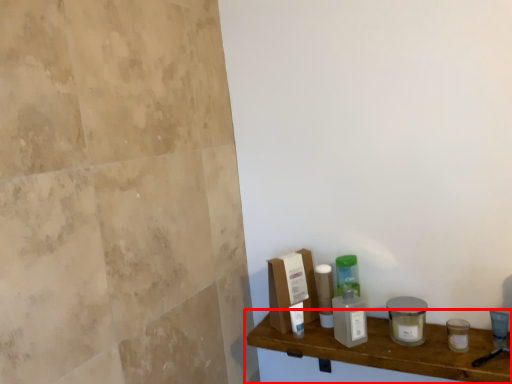
Question: From the image's perspective, where is shelf (annotated by the red box) located in relation to cleaning product in the image?

Choices:
 (A) below
 (B) above

Answer: (A)